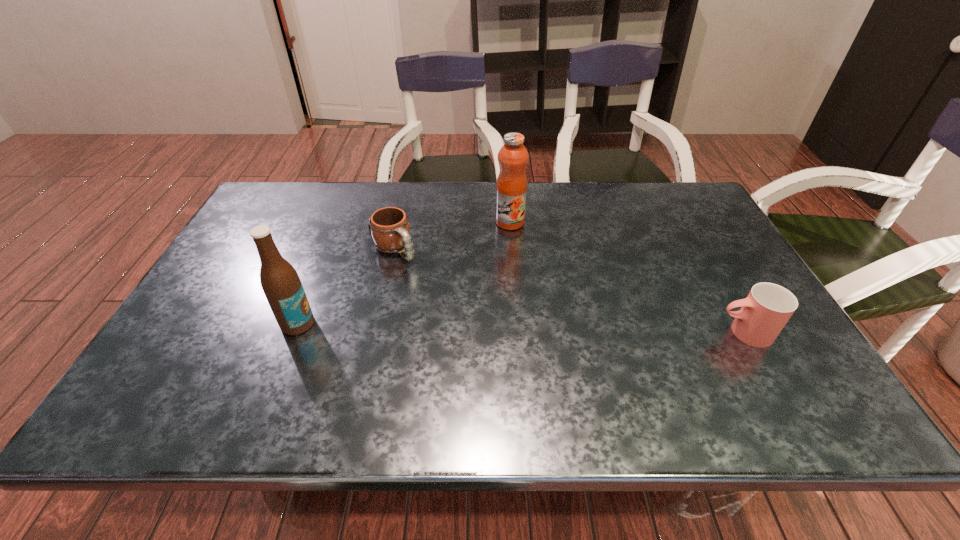
Find the location of `vacant area situated 0.360m on the side of the rightmost object with the handle`. vacant area situated 0.360m on the side of the rightmost object with the handle is located at coordinates (562, 332).

Where is `vacant area situated 0.190m on the front label of the second object from right to left`? Image resolution: width=960 pixels, height=540 pixels. vacant area situated 0.190m on the front label of the second object from right to left is located at coordinates (494, 272).

Where is `vacant space located on the front label of the second object from right to left`? The height and width of the screenshot is (540, 960). vacant space located on the front label of the second object from right to left is located at coordinates (492, 280).

Locate an element on the screen. Image resolution: width=960 pixels, height=540 pixels. vacant point located 0.120m on the front label of the second object from right to left is located at coordinates (499, 256).

The height and width of the screenshot is (540, 960). I want to click on vacant space situated 0.080m on the side of the shortest object with the handle, so click(421, 279).

Find the location of a particular element. This screenshot has width=960, height=540. free spot located 0.190m on the side of the shortest object with the handle is located at coordinates (444, 302).

The height and width of the screenshot is (540, 960). I want to click on blank area located on the side of the shortest object with the handle, so click(x=463, y=322).

Where is `object present at the far edge`? Image resolution: width=960 pixels, height=540 pixels. object present at the far edge is located at coordinates (511, 188).

You are a GUI agent. You are given a task and a screenshot of the screen. Output one action in this format:
    pyautogui.click(x=<x>, y=<y>)
    Task: Click on the object present at the right edge
    The width and height of the screenshot is (960, 540).
    Given the screenshot: What is the action you would take?
    pyautogui.click(x=768, y=307)

Identify the location of free space at the far edge of the desktop. (468, 181).